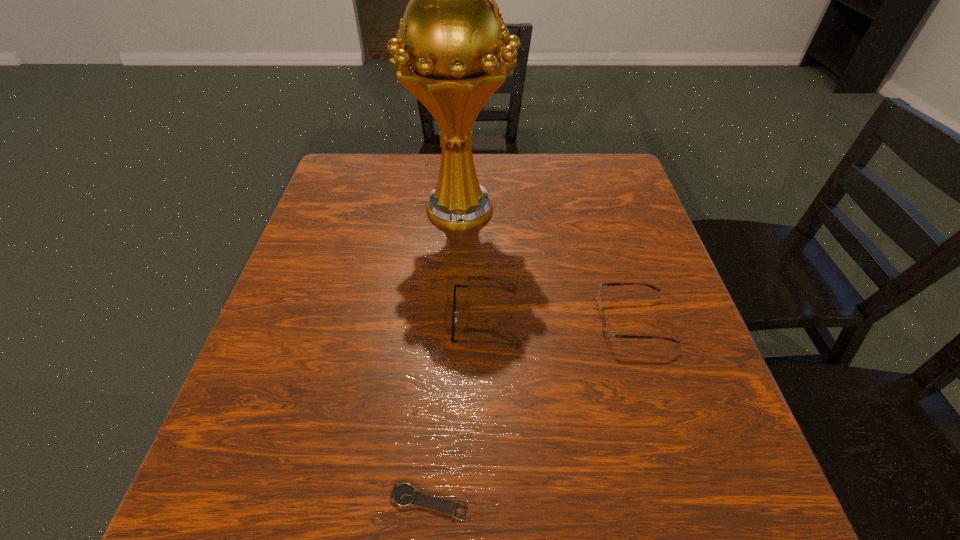
At what (x,y) coordinates should I click in order to perform the action: click on free space at the near edge. Please return your answer as a coordinate pair (x, y). The width and height of the screenshot is (960, 540). Looking at the image, I should click on (522, 483).

At what (x,y) coordinates should I click in order to perform the action: click on vacant space at the left edge of the desktop. Please return your answer as a coordinate pair (x, y). Looking at the image, I should click on (296, 287).

The image size is (960, 540). Identify the location of free space at the right edge. (660, 386).

Where is `vacant space at the far left corner of the desktop`? This screenshot has height=540, width=960. vacant space at the far left corner of the desktop is located at coordinates (361, 153).

The width and height of the screenshot is (960, 540). In the image, there is a desktop. What are the coordinates of `free space at the near left corner` in the screenshot? It's located at (222, 486).

Where is `vacant space at the near right corner of the desktop`? This screenshot has height=540, width=960. vacant space at the near right corner of the desktop is located at coordinates (708, 527).

Where is `vacant space that's between the farthest object and the rightmost object`? The height and width of the screenshot is (540, 960). vacant space that's between the farthest object and the rightmost object is located at coordinates (546, 266).

Locate an element on the screen. The width and height of the screenshot is (960, 540). free spot between the left spectacles and the watch is located at coordinates (457, 411).

I want to click on free space between the third shortest object and the shorter spectacles, so 559,321.

Where is `free spot between the trophy_cup and the left spectacles`? Image resolution: width=960 pixels, height=540 pixels. free spot between the trophy_cup and the left spectacles is located at coordinates (473, 266).